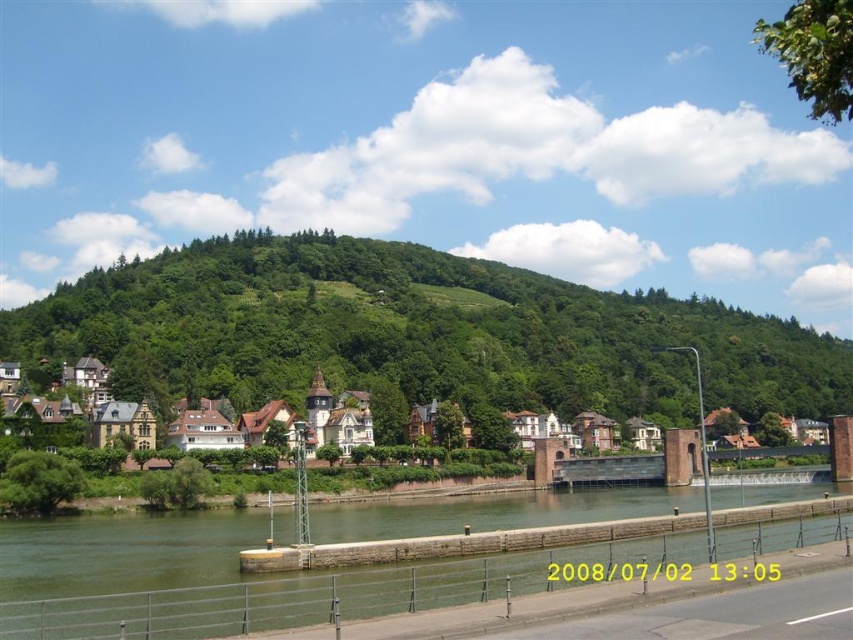
You are a tourist standing on the paved road and want to take a photo of the white wooden houses at left and the green concrete river at lower center. Which object should you focus on first if you want to capture both in one frame without moving your camera?

The green concrete river at lower center is smaller than the white wooden houses at left, so you should focus on the white wooden houses at left first to ensure they are fully captured in the frame before adjusting for the smaller river.

You are standing on the paved road and want to cross to the other side of the river. The white wooden houses at left are on your left. Which direction should you walk to reach the green concrete river at lower center?

You should walk to your right because the green concrete river at lower center is located to the left of the white wooden houses at left, meaning it is positioned further to the left from your current perspective. However, since you want to cross the river, you might need to head towards where the river is, which would be to your left relative to the houses. Wait, there might be confusion here. Let me clarify based on the description.

You are standing at the point marked as point (418, 332) in the image. What can you see around you?

You are at the green leafy hillside at center, which is surrounded by the picturesque riverside scene described in the scene.